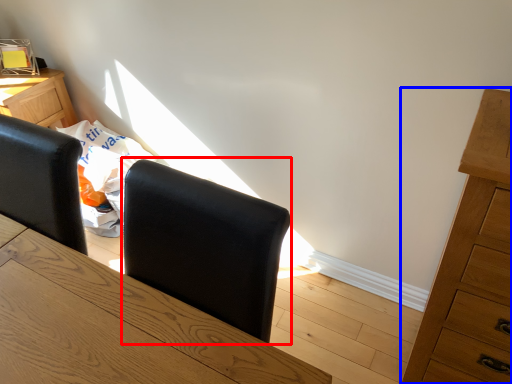
Question: Which of the following is the farthest to the observer, armchair (highlighted by a red box) or chest of drawers (highlighted by a blue box)?

Choices:
 (A) armchair
 (B) chest of drawers

Answer: (B)